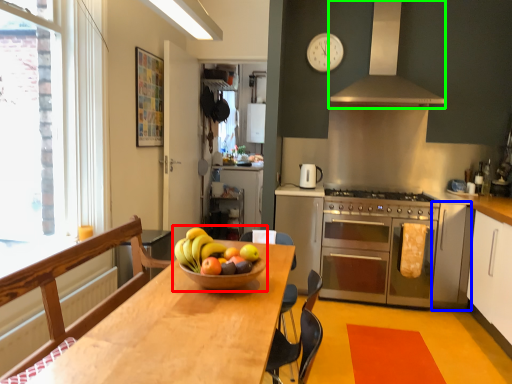
Question: Based on their relative distances, which object is nearer to fruit dish (highlighted by a red box)? Choose from cabinetry (highlighted by a blue box) and exhaust hood (highlighted by a green box).

Choices:
 (A) cabinetry
 (B) exhaust hood

Answer: (A)